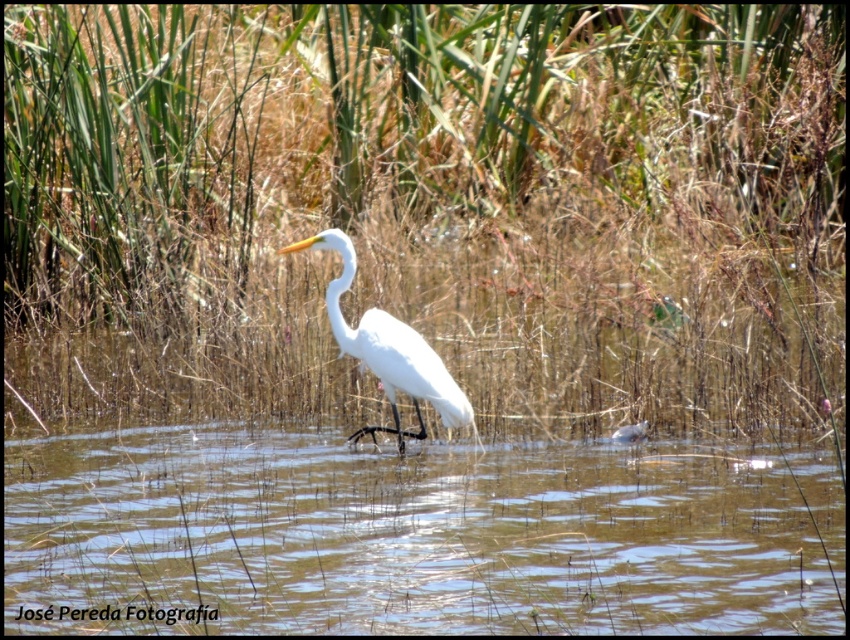
Which is behind, point (224, 157) or point (820, 522)?

The point (224, 157) is behind.

Who is positioned more to the left, green grass at center or clear water at center?

green grass at center is more to the left.

Image resolution: width=850 pixels, height=640 pixels. Identify the location of green grass at center. (425, 208).

The height and width of the screenshot is (640, 850). I want to click on green grass at center, so click(x=425, y=208).

Is green grass at center wider than white smooth heron at center?

Indeed, green grass at center has a greater width compared to white smooth heron at center.

Where is `green grass at center`? green grass at center is located at coordinates (425, 208).

Does clear water at center have a greater width compared to white smooth heron at center?

Yes, clear water at center is wider than white smooth heron at center.

Where is `clear water at center`? The image size is (850, 640). clear water at center is located at coordinates (415, 536).

Identify the location of clear water at center. (415, 536).